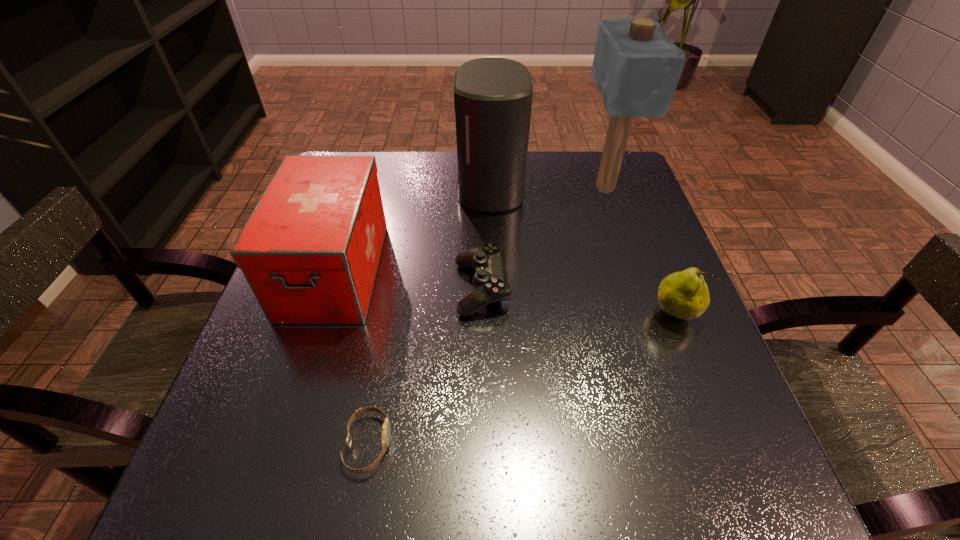
Image resolution: width=960 pixels, height=540 pixels. Find the location of `the tallest object`. the tallest object is located at coordinates (636, 67).

At what (x,y) coordinates should I click in order to perform the action: click on the fifth shortest object. Please return your answer as a coordinate pair (x, y). This screenshot has height=540, width=960. Looking at the image, I should click on (493, 96).

In order to click on the leftmost object in this screenshot , I will do `click(310, 250)`.

I want to click on the first-aid kit, so [310, 250].

Image resolution: width=960 pixels, height=540 pixels. Identify the location of pear. (684, 295).

Identify the location of control. This screenshot has height=540, width=960. (490, 279).

Image resolution: width=960 pixels, height=540 pixels. Find the location of `the nearest object`. the nearest object is located at coordinates (386, 429).

At what (x,y) coordinates should I click in order to perform the action: click on watch. Please return your answer as a coordinate pair (x, y). The height and width of the screenshot is (540, 960). Looking at the image, I should click on (386, 429).

Where is `blank space located on the left of the tallest object`? The width and height of the screenshot is (960, 540). blank space located on the left of the tallest object is located at coordinates (426, 187).

At what (x,y) coordinates should I click in order to perform the action: click on free space located 0.150m on the button side of the coffee maker. Please return your answer as a coordinate pair (x, y). The width and height of the screenshot is (960, 540). Looking at the image, I should click on (399, 188).